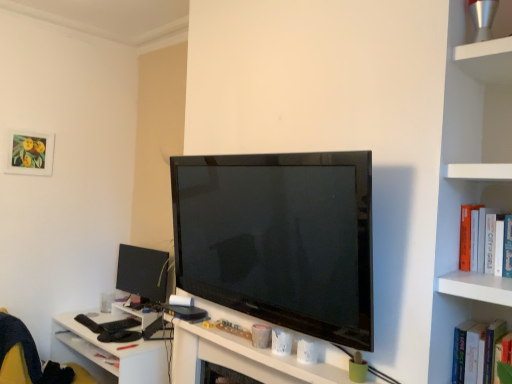
Question: Is matte black monitor at lower left in front of or behind matte paper picture frame at upper left in the image?

Choices:
 (A) front
 (B) behind

Answer: (B)

Question: Is matte black monitor at lower left situated inside matte paper picture frame at upper left or outside?

Choices:
 (A) inside
 (B) outside

Answer: (B)

Question: Which of these objects is positioned farthest from the white glossy table at lower left?

Choices:
 (A) yellow fabric swivel chair at lower left
 (B) matte black monitor at lower left
 (C) white matte computer desk at center
 (D) matte paper picture frame at upper left
 (E) white hardcover book at right

Answer: (E)

Question: Which is farther from the white hardcover book at right?

Choices:
 (A) matte paper picture frame at upper left
 (B) white glossy table at lower left
 (C) matte black monitor at lower left
 (D) yellow fabric swivel chair at lower left
 (E) white matte computer desk at center

Answer: (A)